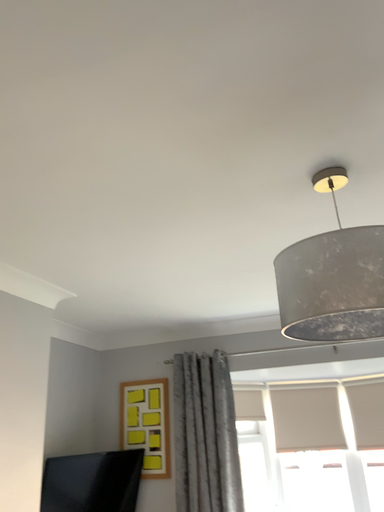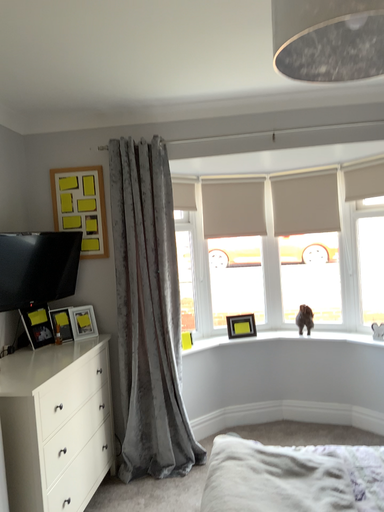
Question: Which way did the camera rotate in the video?

Choices:
 (A) rotated right
 (B) rotated left

Answer: (A)